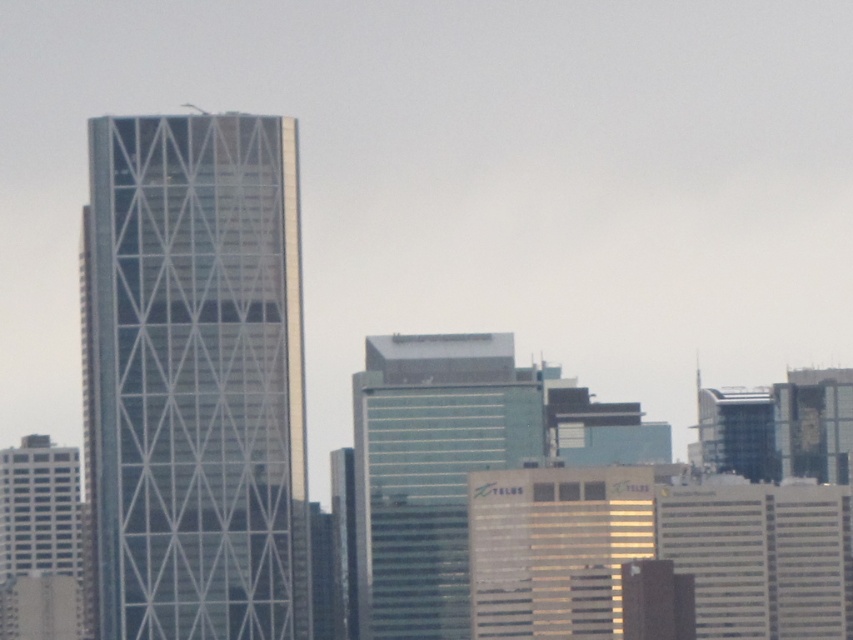
Is point (244, 609) closer to camera compared to point (462, 500)?

That is False.

Does metallic glass tower at left have a greater width compared to green glass building at center?

Yes, metallic glass tower at left is wider than green glass building at center.

Which is in front, point (189, 300) or point (404, 432)?

Point (404, 432)

At what (x,y) coordinates should I click in order to perform the action: click on metallic glass tower at left. Please return your answer as a coordinate pair (x, y). The height and width of the screenshot is (640, 853). Looking at the image, I should click on (194, 378).